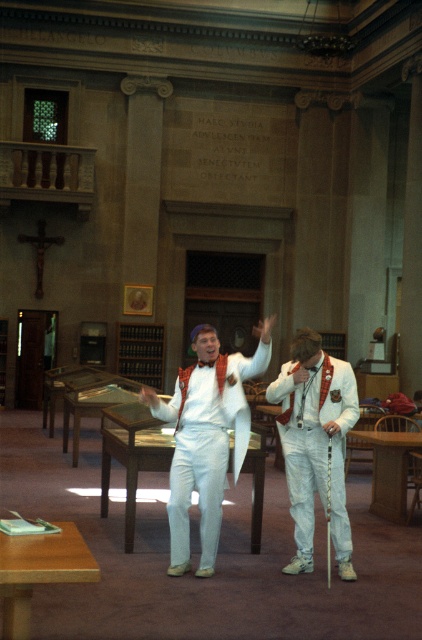
Based on the photo, you are organizing a formal event in this grand library. You need to place a 1.5 meter wide decorative panel between the white cotton suit at center and the wooden table at lower left. Considering their widths, will the panel fit between them?

The white cotton suit at center is wider than the wooden table at lower left. Since the panel is 1.5 meters wide, the combined width of both objects exceeds the panel, so it won

You are a person who is 1.8 meters tall and want to place a 2.5 meters long ladder between the white cotton suit at center and the wooden table at lower left. Is there enough space to place the ladder horizontally between them?

The distance between the white cotton suit at center and the wooden table at lower left is 2.64 meters. Since the ladder is 2.5 meters long, there is sufficient space to place it horizontally between them as the distance is greater than the ladder length.

Please look at the image. There is a point marked at coordinates (205, 436). Based on the scene description, where is this point located?

The point is located on the white satin suit at center.